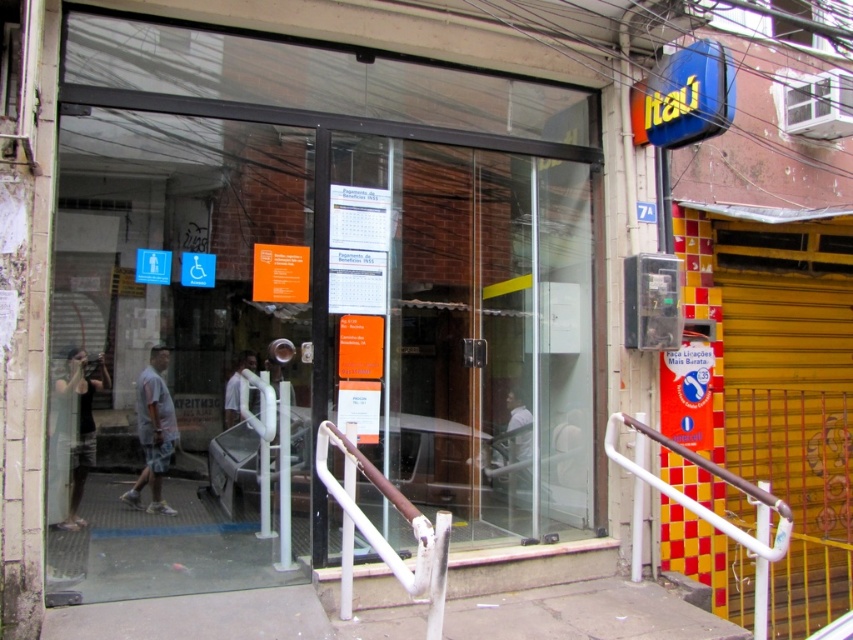
Is white metal handrail at lower right wider than gray cotton shorts at lower left?

No.

The height and width of the screenshot is (640, 853). In order to click on white metal handrail at lower right in this screenshot , I will do `click(694, 499)`.

In the scene shown: Does transparent glass door at center appear on the left side of white matte shirt at center?

In fact, transparent glass door at center is to the right of white matte shirt at center.

Is transparent glass door at center above white matte shirt at center?

Correct, transparent glass door at center is located above white matte shirt at center.

Between point (494, 525) and point (234, 413), which one is positioned behind?

The point (234, 413) is more distant.

Where is `transparent glass door at center`? This screenshot has width=853, height=640. transparent glass door at center is located at coordinates (479, 332).

Does matte black shirt at left have a smaller size compared to white matte shirt at center?

Actually, matte black shirt at left might be larger than white matte shirt at center.

Where is `matte black shirt at left`? This screenshot has width=853, height=640. matte black shirt at left is located at coordinates (80, 426).